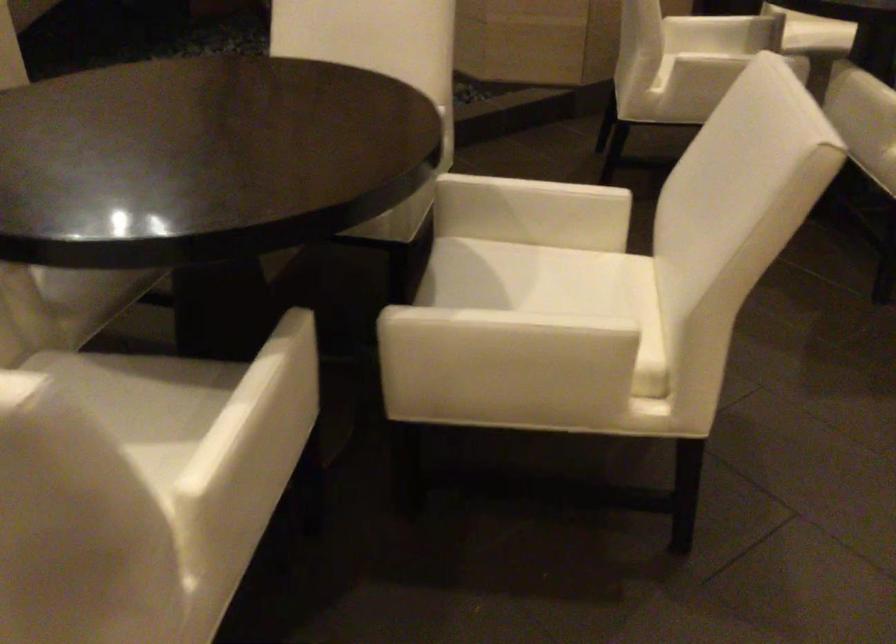
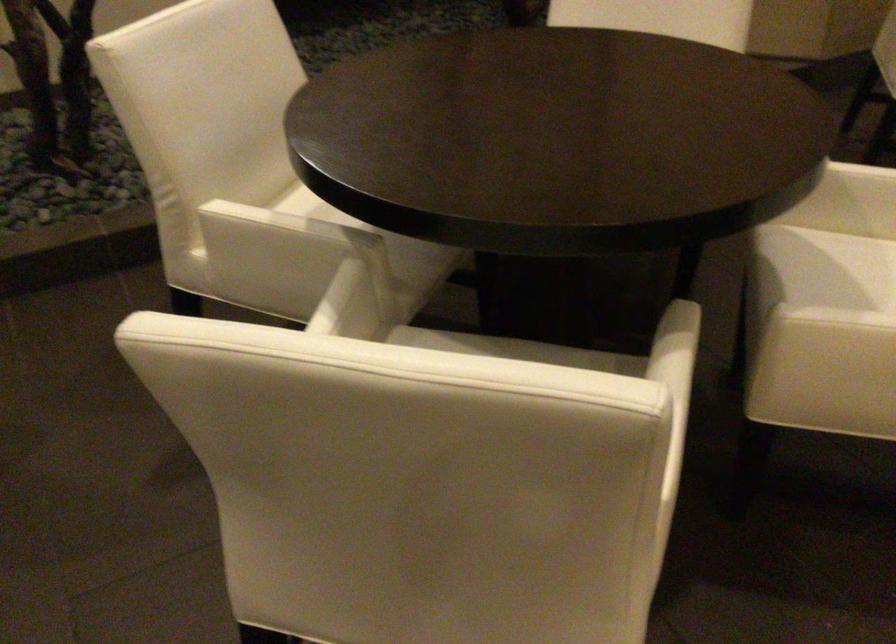
Question: I am providing you with two images of the same scene from different viewpoints. After the viewpoint changes to image2, which objects are now occluded?

Choices:
 (A) white chair sitting surface
 (B) white chair armrest
 (C) silver metal pitcher
 (D) chair sitting surface

Answer: (A)